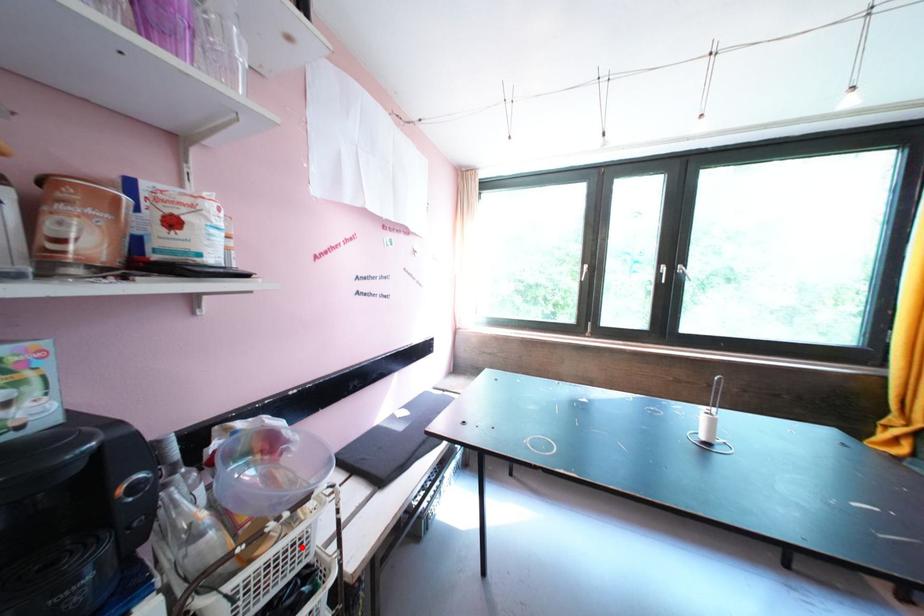
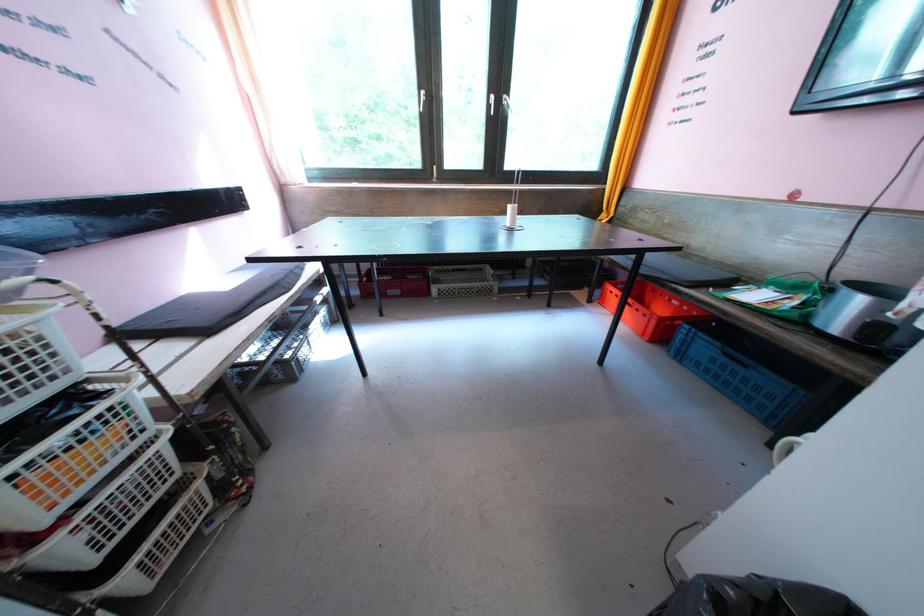
The point at the highlighted location is marked in the first image. Where is the corresponding point in the second image?

(15, 354)